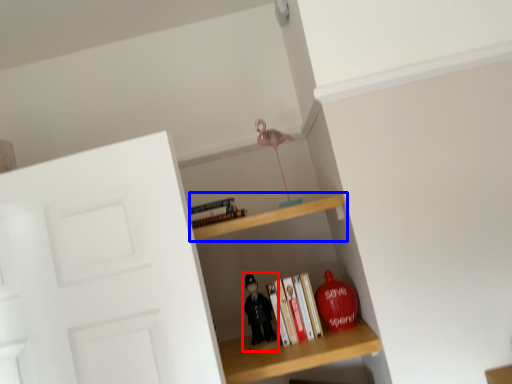
Question: Among these objects, which one is farthest to the camera, toy (highlighted by a red box) or shelf (highlighted by a blue box)?

Choices:
 (A) toy
 (B) shelf

Answer: (A)